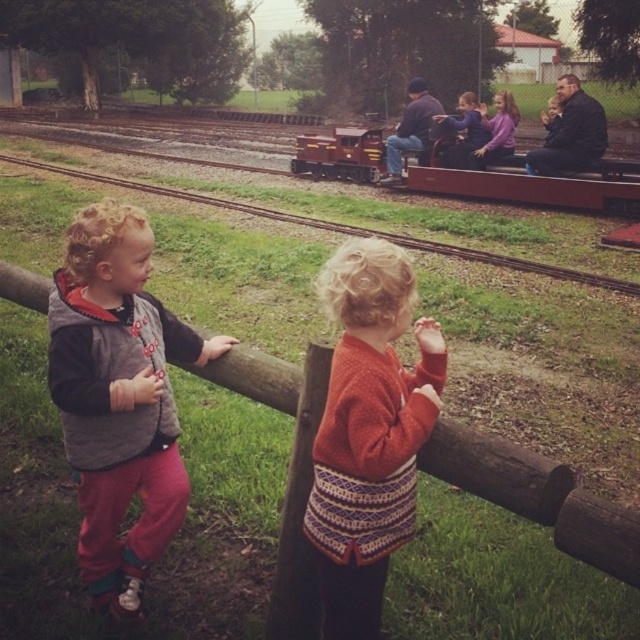
Is point (339, 458) positioned after point (310, 593)?

No, (339, 458) is in front of (310, 593).

Does knitted sweater at center appear on the right side of knitted wool sweater at upper center?

Indeed, knitted sweater at center is positioned on the right side of knitted wool sweater at upper center.

Image resolution: width=640 pixels, height=640 pixels. What are the coordinates of `knitted sweater at center` in the screenshot? It's located at (369, 432).

Who is more forward, (605, 211) or (312, 573)?

Point (312, 573)

Is wooden toy train at center thinner than knitted wool sweater at upper center?

No, wooden toy train at center is not thinner than knitted wool sweater at upper center.

The width and height of the screenshot is (640, 640). I want to click on wooden toy train at center, so click(x=534, y=184).

You are a GUI agent. You are given a task and a screenshot of the screen. Output one action in this format:
    pyautogui.click(x=<x>, y=<y>)
    Task: Click on the wooden toy train at center
    The image size is (640, 640).
    Given the screenshot: What is the action you would take?
    pyautogui.click(x=534, y=184)

In the scene shown: Is wooden toy train at center to the left of brown wooden fence at lower center from the viewer's perspective?

In fact, wooden toy train at center is to the right of brown wooden fence at lower center.

Who is more forward, (576, 196) or (620, 284)?

Positioned in front is point (620, 284).

The width and height of the screenshot is (640, 640). Find the location of `wooden toy train at center`. wooden toy train at center is located at coordinates (534, 184).